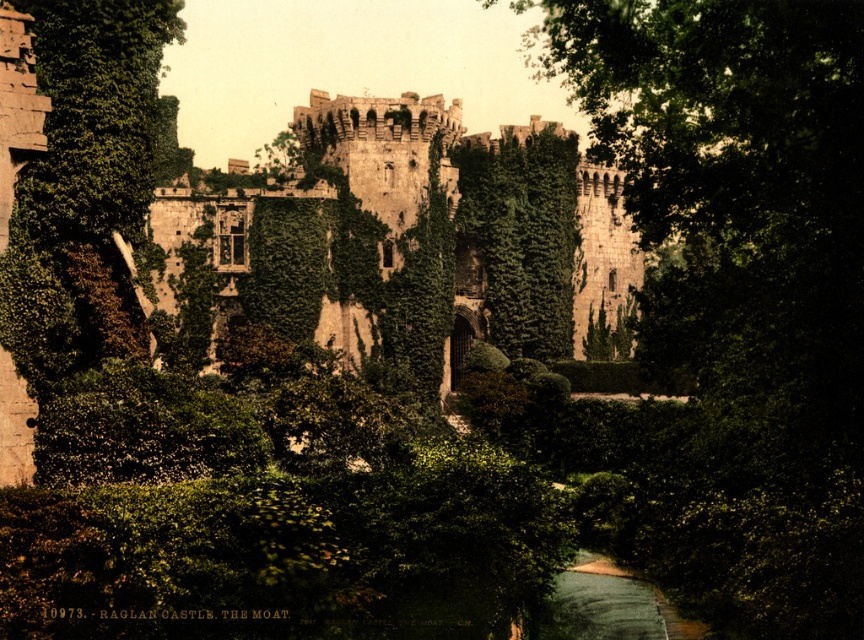
What do you see at coordinates (739, 291) in the screenshot?
I see `green leafy tree at center` at bounding box center [739, 291].

How distant is green leafy tree at center from stone castle at center?

A distance of 20.17 meters exists between green leafy tree at center and stone castle at center.

Where is `green leafy tree at center`? This screenshot has width=864, height=640. green leafy tree at center is located at coordinates (739, 291).